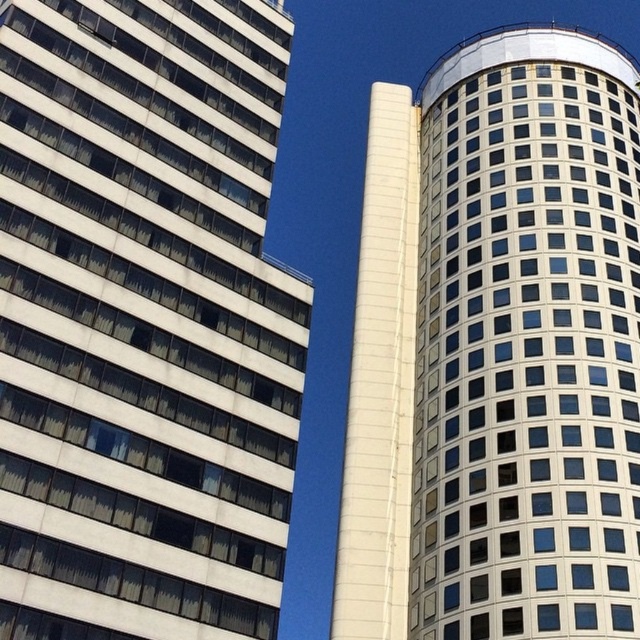
Describe the element at coordinates (144, 321) in the screenshot. The width and height of the screenshot is (640, 640). I see `white glass building at left` at that location.

The image size is (640, 640). I want to click on white glass building at left, so click(x=144, y=321).